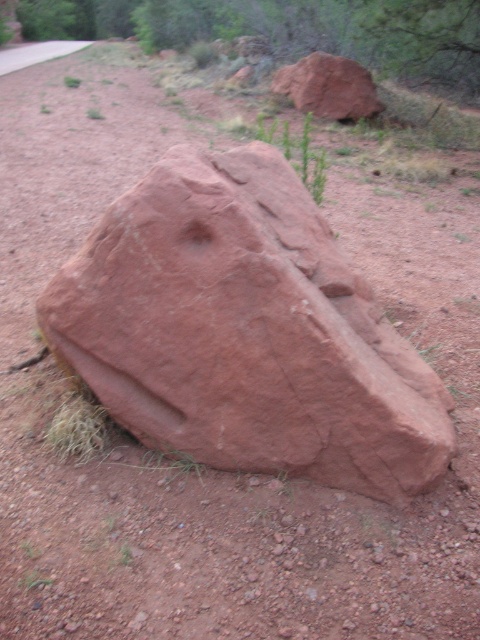
Question: Which of these objects is positioned closest to the green leafy plant at center?

Choices:
 (A) smooth concrete path at upper left
 (B) rusty stone boulder at upper center

Answer: (B)

Question: Considering the relative positions of green leafy plant at center and smooth concrete path at upper left in the image provided, where is green leafy plant at center located with respect to smooth concrete path at upper left?

Choices:
 (A) left
 (B) right

Answer: (B)

Question: Can you confirm if green leafy plant at center is thinner than smooth concrete path at upper left?

Choices:
 (A) yes
 (B) no

Answer: (A)

Question: Which point is closer to the camera?

Choices:
 (A) (309, 122)
 (B) (300, 60)
 (C) (4, 49)

Answer: (A)

Question: Which of the following is the closest to the observer?

Choices:
 (A) smooth concrete path at upper left
 (B) green leafy plant at center
 (C) rusty stone boulder at upper center

Answer: (B)

Question: From the image, what is the correct spatial relationship of rusty stone boulder at upper center in relation to smooth concrete path at upper left?

Choices:
 (A) above
 (B) below

Answer: (B)